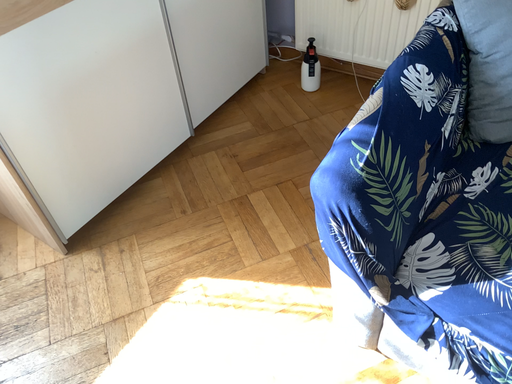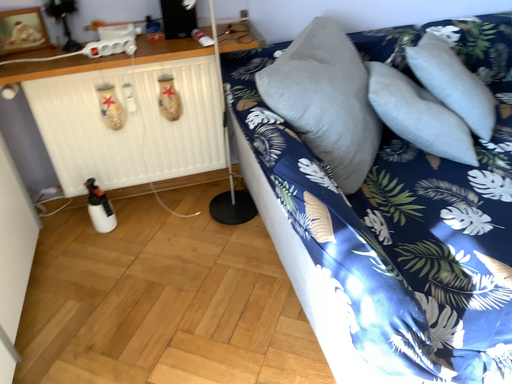
Question: How did the camera likely rotate when shooting the video?

Choices:
 (A) rotated right
 (B) rotated left

Answer: (A)